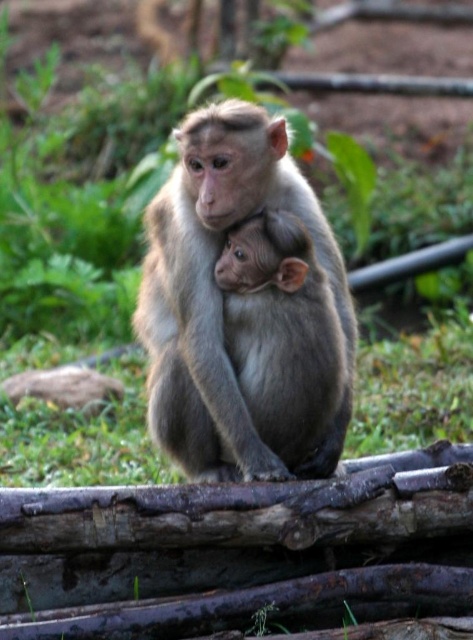
Is light brown fur monkey at center smaller than gray furry monkey at center?

Actually, light brown fur monkey at center might be larger than gray furry monkey at center.

This screenshot has height=640, width=473. What do you see at coordinates (213, 268) in the screenshot?
I see `light brown fur monkey at center` at bounding box center [213, 268].

Between point (305, 192) and point (282, 320), which one is positioned behind?

The point (305, 192) is behind.

At what (x,y) coordinates should I click in order to perform the action: click on light brown fur monkey at center. Please return your answer as a coordinate pair (x, y). The width and height of the screenshot is (473, 640). Looking at the image, I should click on (213, 268).